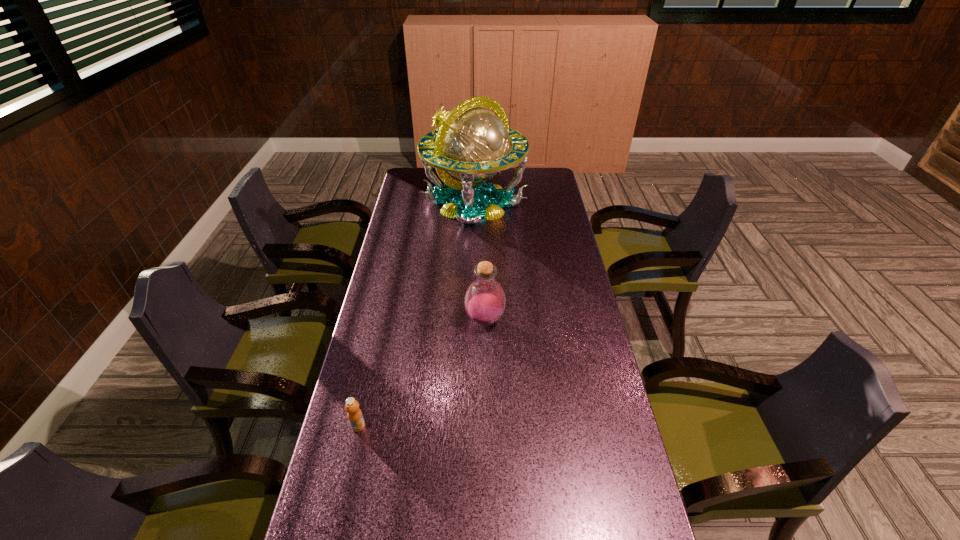
Find the location of `globe positioned at the left edge`. globe positioned at the left edge is located at coordinates (472, 144).

This screenshot has width=960, height=540. Identify the location of orange juice at the left edge. (354, 413).

Where is `object that is positioned at the right edge`? This screenshot has height=540, width=960. object that is positioned at the right edge is located at coordinates (472, 144).

Locate an element on the screen. object that is at the far left corner is located at coordinates (472, 144).

The width and height of the screenshot is (960, 540). Identify the location of object that is at the far right corner. (472, 144).

This screenshot has width=960, height=540. In the image, there is a desktop. Identify the location of vacant space at the left edge. (x=379, y=335).

The width and height of the screenshot is (960, 540). In the image, there is a desktop. In order to click on free region at the right edge in this screenshot , I will do `click(572, 279)`.

Where is `free space at the far left corner`? The width and height of the screenshot is (960, 540). free space at the far left corner is located at coordinates (408, 176).

In the image, there is a desktop. Where is `vacant space at the far right corner`? vacant space at the far right corner is located at coordinates [x=543, y=180].

This screenshot has height=540, width=960. What are the coordinates of `free spot between the leftmost object and the tallest object` in the screenshot? It's located at (417, 314).